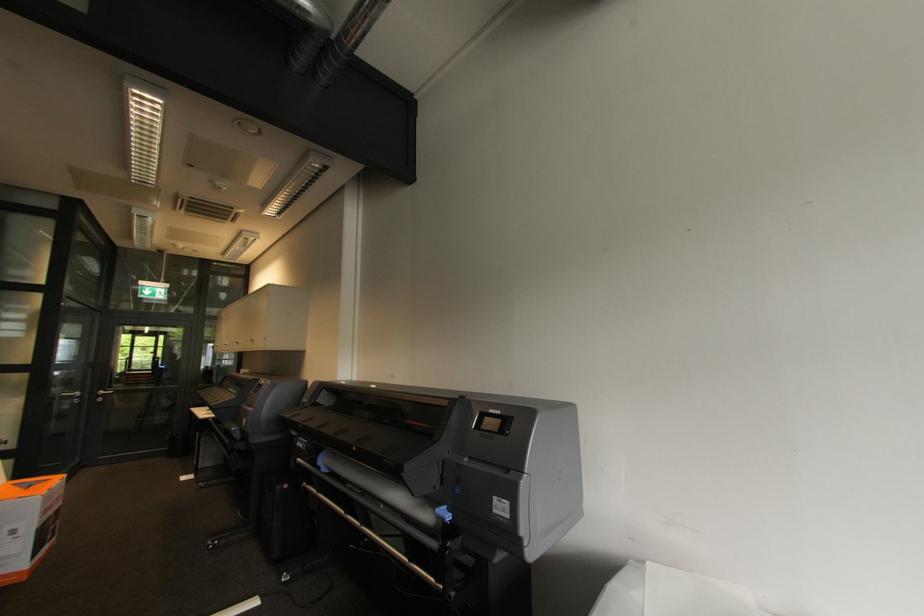
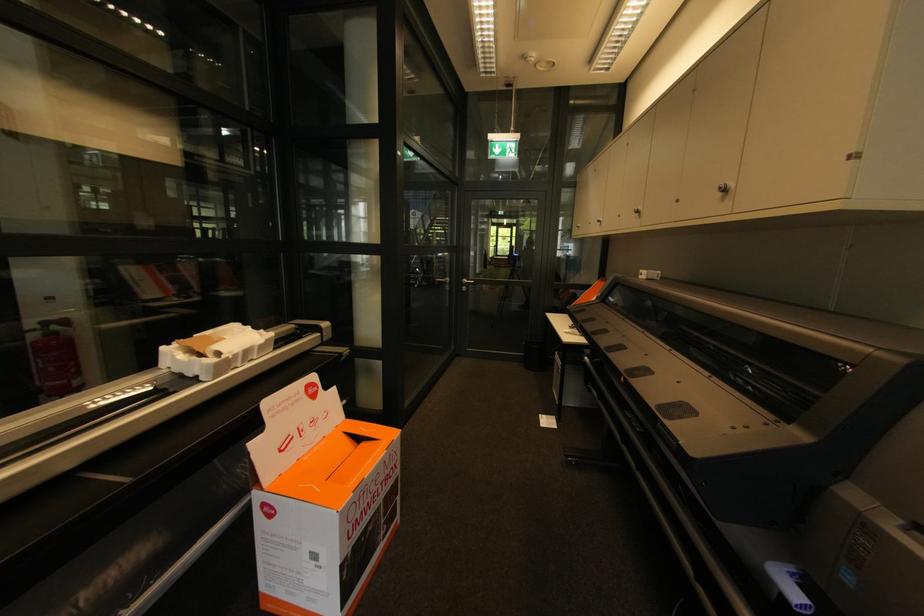
The point at (256, 342) is marked in the first image. Where is the corresponding point in the second image?

(727, 191)